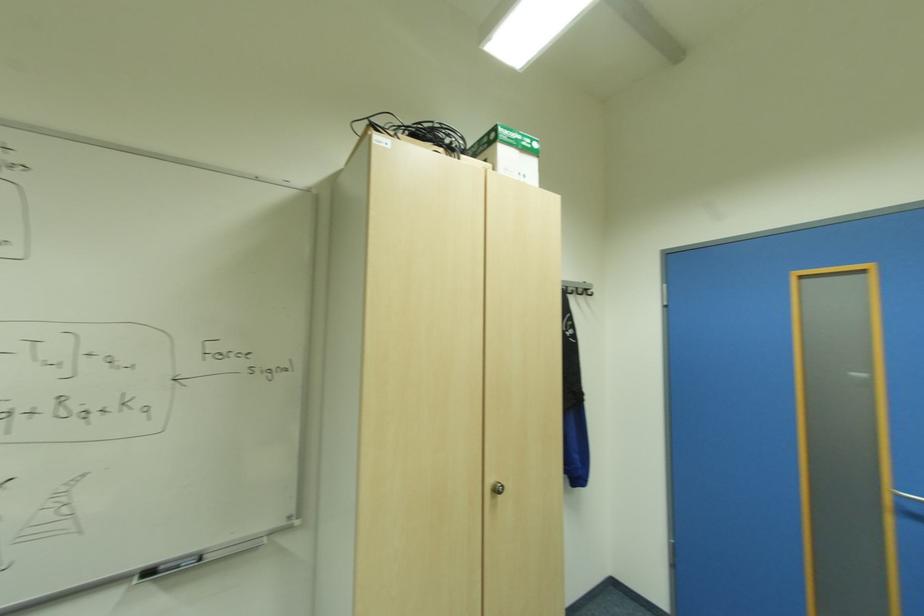
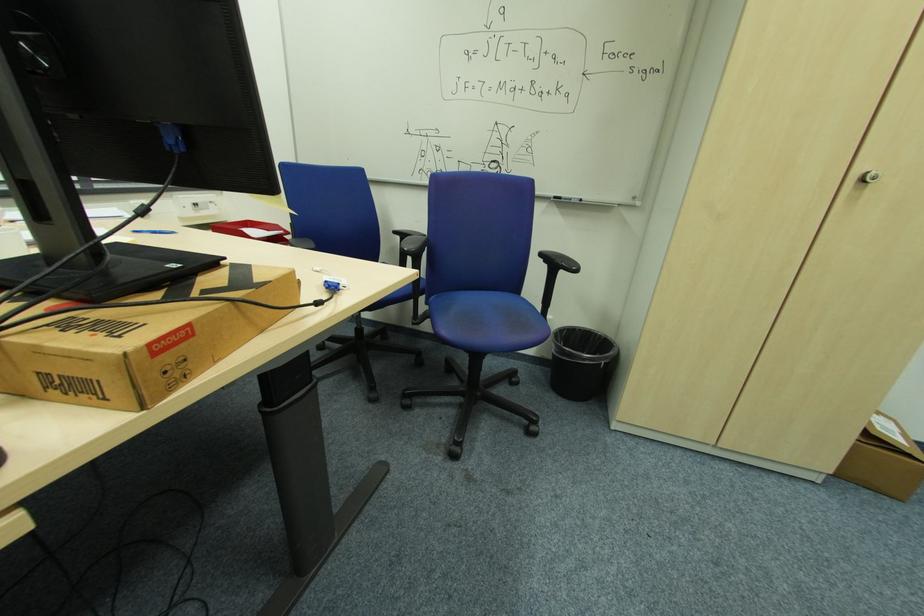
From the picture: Based on the continuous images, in which direction is the camera rotating?

The rotation direction of the camera is left-down.